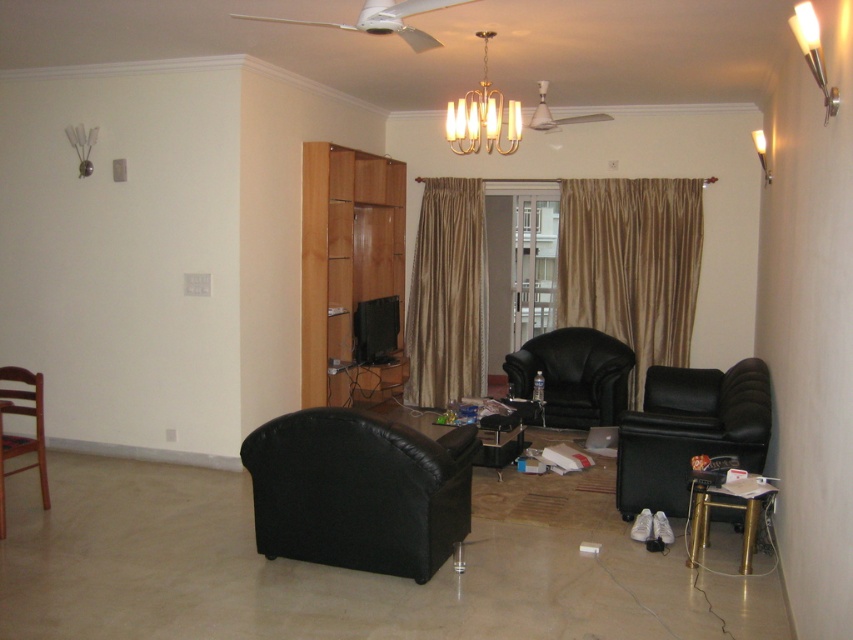
You are standing in the living room and want to sit down. There is a black leather armchair at right located at point (689,432). Can you walk directly to that chair from your current position?

Yes, you can walk directly to the black leather armchair at right located at point (689,432) because there are no obstacles mentioned in the scene description between your current position and the chair.

You are sitting on the brown wooden chair at left and want to move to the black leather armchair at right. Which direction should you move to reach it?

The black leather armchair at right is located above the brown wooden chair at left, so you should move upward to reach it.

From the picture: You are standing in the living room and want to know how far the point at coordinates (572, 406) is from your current position. Can you determine the distance?

The point at coordinates (572, 406) is 20.90 feet away from the camera, so the distance from your current position is approximately 20.90 feet.